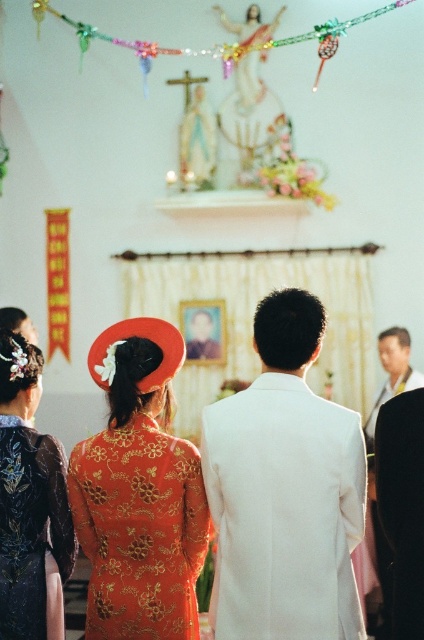
Where is `white matte suit at center`? This screenshot has width=424, height=640. white matte suit at center is located at coordinates (284, 490).

Where is `white matte suit at center`? white matte suit at center is located at coordinates (284, 490).

Is white matte suit at center thinner than shiny gold dress at center?

In fact, white matte suit at center might be wider than shiny gold dress at center.

Locate an element on the screen. white matte suit at center is located at coordinates (284, 490).

Is shiny orange dress at center further to camera compared to smooth black suit at right?

No, shiny orange dress at center is in front of smooth black suit at right.

Does shiny orange dress at center have a greater height compared to smooth black suit at right?

Indeed, shiny orange dress at center has a greater height compared to smooth black suit at right.

Is point (181, 353) positioned after point (384, 349)?

No, it is not.

Find the location of a particular element. The height and width of the screenshot is (640, 424). shiny orange dress at center is located at coordinates (139, 492).